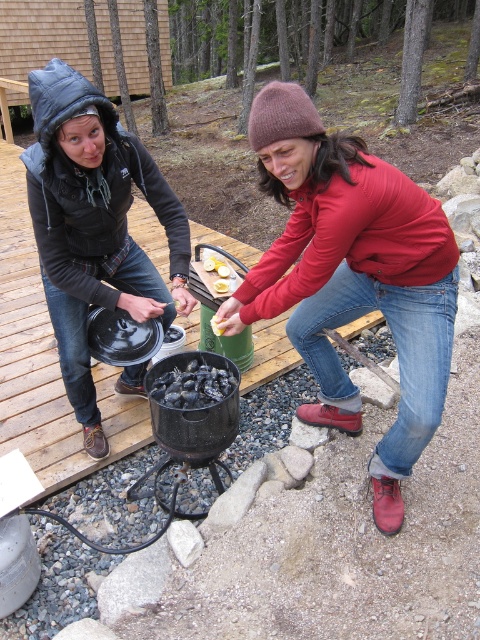
Question: Does red matte jacket at center appear under yellow matte lemon at center?

Choices:
 (A) no
 (B) yes

Answer: (B)

Question: Which point is closer to the camera?

Choices:
 (A) (222, 280)
 (B) (400, 452)

Answer: (B)

Question: Can you confirm if red matte jacket at center is wider than yellow matte lemon at center?

Choices:
 (A) yes
 (B) no

Answer: (A)

Question: Which object is farther from the camera taking this photo?

Choices:
 (A) yellow soft-boiled egg at center
 (B) yellow rubber glove at center

Answer: (B)

Question: Estimate the real-world distances between objects in this image. Which object is closer to the charcoal briquettes at center?

Choices:
 (A) red matte jacket at center
 (B) yellow rubber glove at center
 (C) yellow matte lemon at center
 (D) yellow soft-boiled egg at center

Answer: (D)

Question: Does yellow matte lemon at center have a larger size compared to yellow soft-boiled egg at center?

Choices:
 (A) no
 (B) yes

Answer: (B)